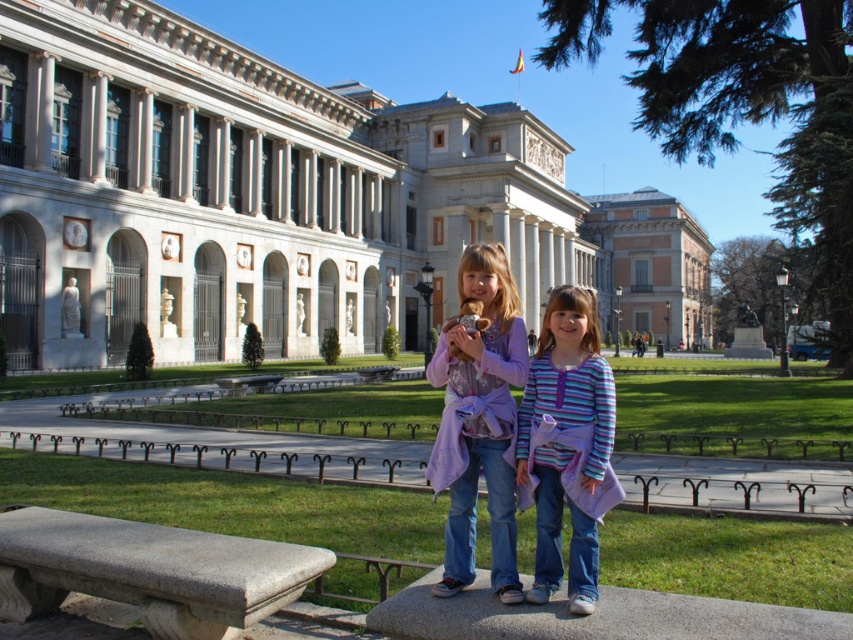
Question: Which object appears closest to the camera in this image?

Choices:
 (A) matte stone building at center
 (B) granite bench at center

Answer: (B)

Question: Does purple fabric dress at center appear under striped fabric shirt at center?

Choices:
 (A) no
 (B) yes

Answer: (A)

Question: Which of these objects is positioned farthest from the granite bench at lower left?

Choices:
 (A) striped fabric shirt at center
 (B) granite bench at center
 (C) smooth concrete bench at center
 (D) purple fabric dress at center

Answer: (C)

Question: Is white marble building at center above smooth concrete bench at center?

Choices:
 (A) yes
 (B) no

Answer: (A)

Question: Is purple fabric dress at center bigger than matte stone building at center?

Choices:
 (A) yes
 (B) no

Answer: (B)

Question: Which of the following is the farthest from the observer?

Choices:
 (A) (607, 200)
 (B) (167, 576)
 (C) (223, 385)

Answer: (A)